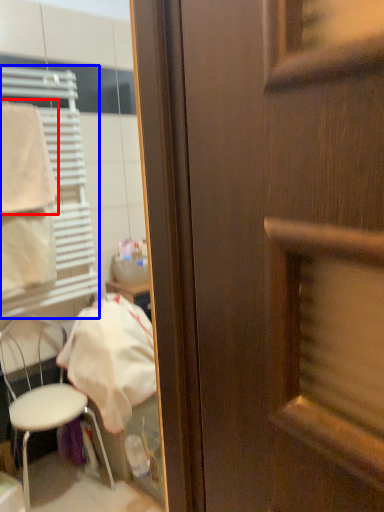
Question: Which object is further to the camera taking this photo, towel/napkin (highlighted by a red box) or shutter (highlighted by a blue box)?

Choices:
 (A) towel/napkin
 (B) shutter

Answer: (A)